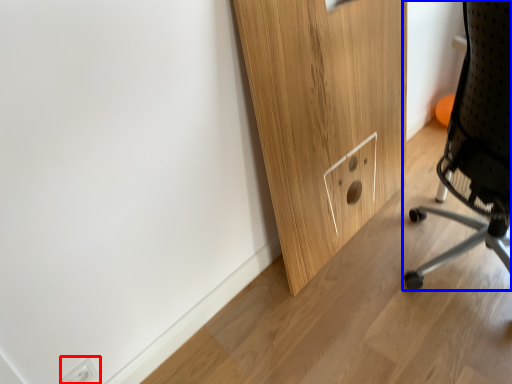
Question: Which point is further to the camera, electric outlet (highlighted by a red box) or chair (highlighted by a blue box)?

Choices:
 (A) electric outlet
 (B) chair

Answer: (A)